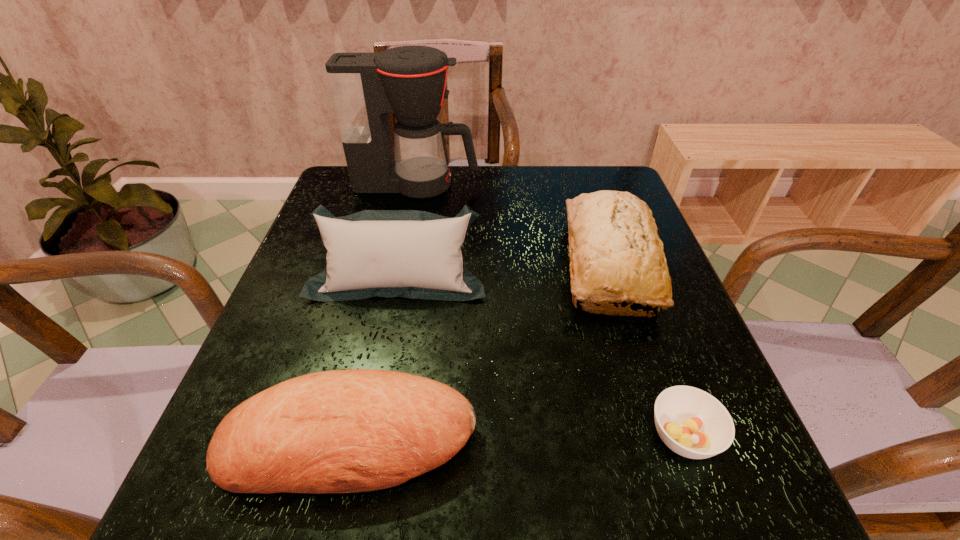
Find the location of a particular element. The width and height of the screenshot is (960, 540). free space at the far right corner is located at coordinates (617, 182).

The height and width of the screenshot is (540, 960). What are the coordinates of `vacant space that's between the left bread and the cushion` in the screenshot? It's located at (374, 359).

Locate an element on the screen. The height and width of the screenshot is (540, 960). vacant area that lies between the left bread and the cushion is located at coordinates (374, 359).

This screenshot has height=540, width=960. Identify the location of free space that is in between the fourth tallest object and the cushion. (374, 359).

Where is `free point between the right bread and the cushion`? free point between the right bread and the cushion is located at coordinates (503, 271).

At what (x,y) coordinates should I click in order to perform the action: click on free spot between the left bread and the cushion. Please return your answer as a coordinate pair (x, y). Image resolution: width=960 pixels, height=540 pixels. Looking at the image, I should click on (374, 359).

Image resolution: width=960 pixels, height=540 pixels. In order to click on free area in between the right bread and the tallest object in this screenshot , I will do `click(513, 224)`.

Where is `free spot between the farther bread and the farthest object`? This screenshot has width=960, height=540. free spot between the farther bread and the farthest object is located at coordinates (513, 224).

Where is `empty space between the shortest object and the cushion`? Image resolution: width=960 pixels, height=540 pixels. empty space between the shortest object and the cushion is located at coordinates (540, 357).

The height and width of the screenshot is (540, 960). In order to click on empty location between the shortest object and the tallest object in this screenshot , I will do `click(550, 310)`.